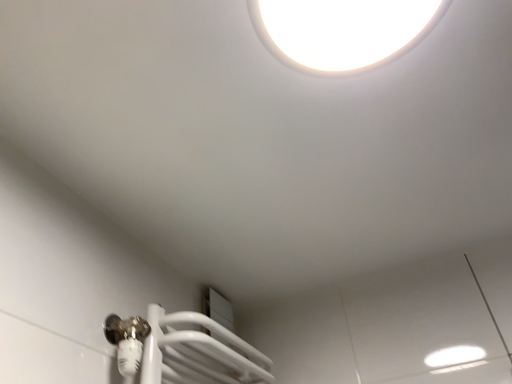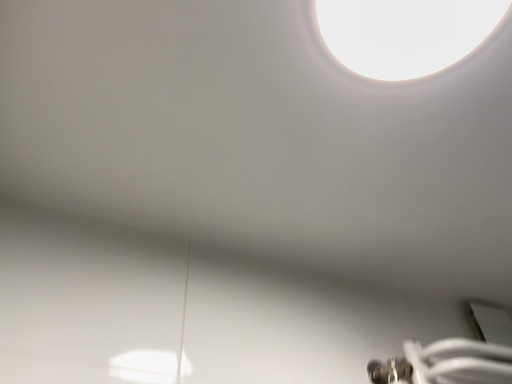
Question: Which way did the camera rotate in the video?

Choices:
 (A) rotated right
 (B) rotated left

Answer: (B)